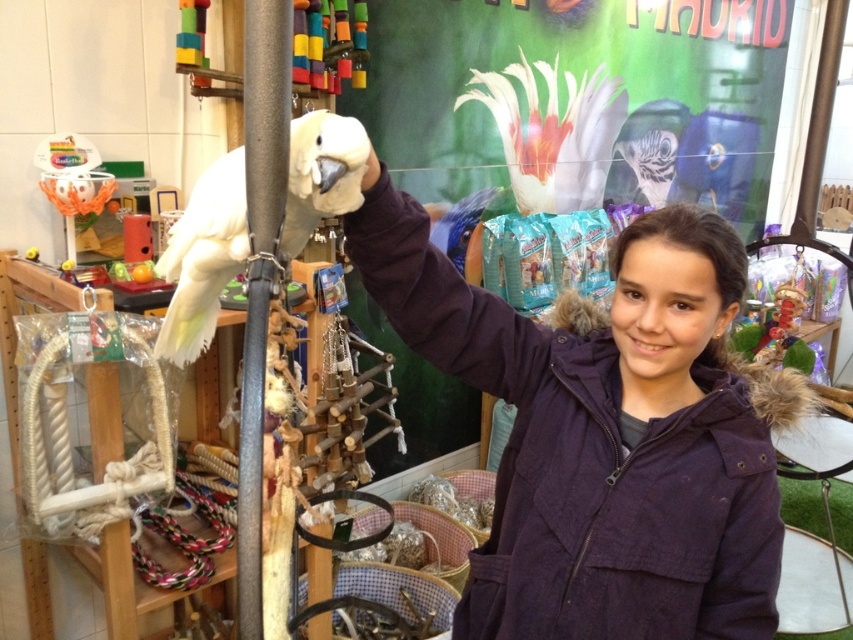
Question: Does purple cotton jacket at center have a larger size compared to white feathered parrot at center?

Choices:
 (A) no
 (B) yes

Answer: (B)

Question: Which object appears closest to the camera in this image?

Choices:
 (A) purple cotton jacket at center
 (B) white feathered parrot at center

Answer: (B)

Question: Can you confirm if purple cotton jacket at center is bigger than black matte pole at center?

Choices:
 (A) yes
 (B) no

Answer: (A)

Question: Which of the following is the closest to the observer?

Choices:
 (A) (338, 152)
 (B) (254, 97)

Answer: (B)

Question: Which point appears closest to the camera in this image?

Choices:
 (A) (491, 596)
 (B) (297, 170)

Answer: (B)

Question: Is purple cotton jacket at center closer to camera compared to black matte pole at center?

Choices:
 (A) no
 (B) yes

Answer: (A)